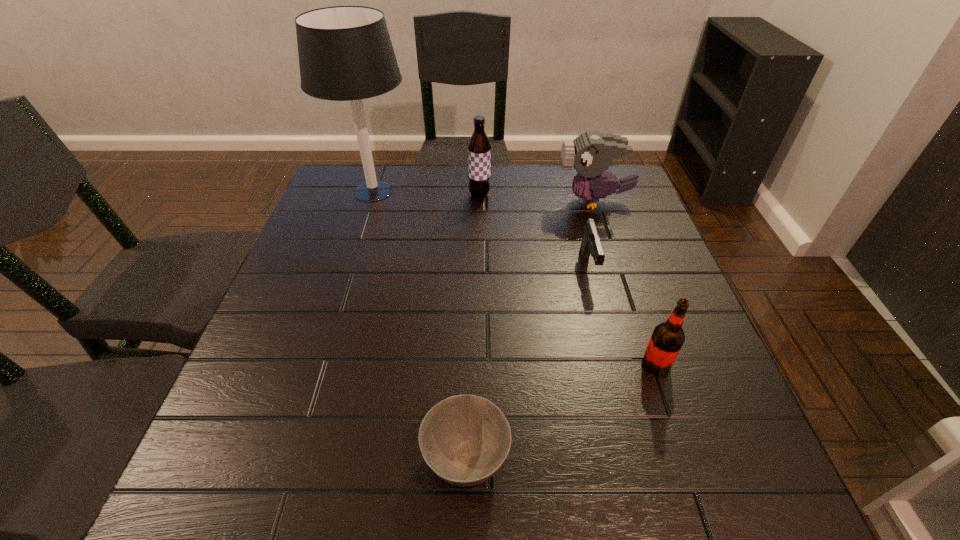
In order to click on the tallest object in this screenshot , I will do `click(345, 53)`.

Image resolution: width=960 pixels, height=540 pixels. I want to click on table lamp, so click(x=345, y=53).

Locate an element on the screen. The image size is (960, 540). the farther root beer is located at coordinates (479, 148).

This screenshot has height=540, width=960. Identify the location of the taller root beer. (479, 148).

In order to click on bird in this screenshot , I will do `click(591, 153)`.

This screenshot has width=960, height=540. I want to click on the fifth farthest object, so click(667, 338).

You are a GUI agent. You are given a task and a screenshot of the screen. Output one action in this format:
    pyautogui.click(x=<x>, y=<y>)
    Task: Click on the shorter root beer
    
    Given the screenshot: What is the action you would take?
    pyautogui.click(x=667, y=338)

You are a GUI agent. You are given a task and a screenshot of the screen. Output one action in this format:
    pyautogui.click(x=<x>, y=<y>)
    Task: Click on the fifth tallest object
    The width and height of the screenshot is (960, 540).
    Given the screenshot: What is the action you would take?
    590,243

You are a GUI agent. You are given a task and a screenshot of the screen. Output one action in this format:
    pyautogui.click(x=<x>, y=<y>)
    Task: Click on the pistol
    Image resolution: width=960 pixels, height=540 pixels.
    Given the screenshot: What is the action you would take?
    pyautogui.click(x=590, y=243)

You are a GUI agent. You are given a task and a screenshot of the screen. Output one action in this format:
    pyautogui.click(x=<x>, y=<y>)
    Task: Click on the shortest object
    The image size is (960, 540).
    Given the screenshot: What is the action you would take?
    pyautogui.click(x=465, y=439)